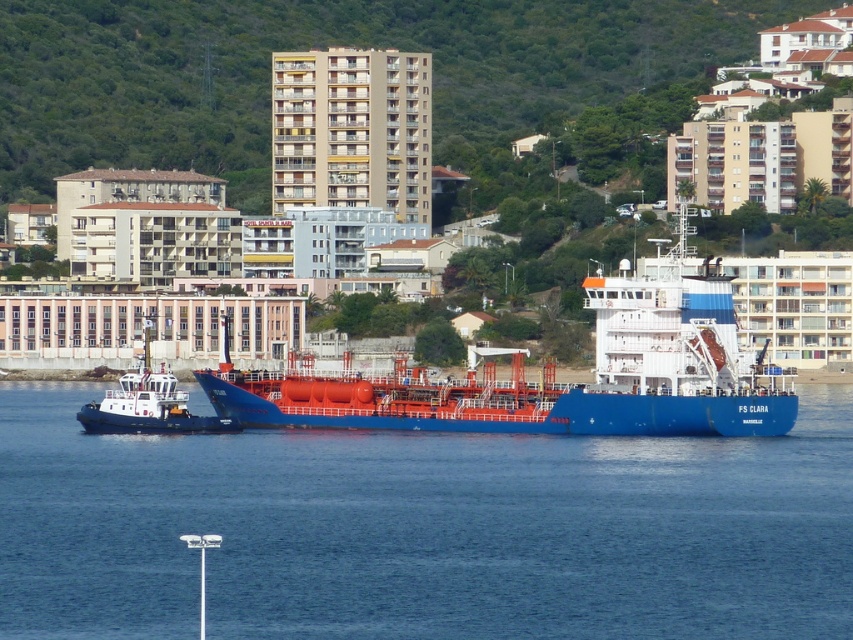
You are a harbor pilot planning to maneuver the blue matte ship at center into a nearby dock. The minimum safe distance required between the ship and any nearby structures is 1000 feet. Can the ship safely dock without violating the safety regulations?

The blue matte ship at center is 1030.60 feet away from the nearest structure. Since this distance exceeds the minimum safe requirement of 1000 feet, the ship can safely dock without violating safety regulations.

Consider the image. You are standing on the dock and see the blue matte ship at center and the blue water at center. Which object is positioned lower in the scene?

The blue water at center is located below the blue matte ship at center, so it is positioned lower in the scene.

You are standing on the deck of the FS CLARA cargo ship and want to know the distance to the point at coordinates (593, 276). Can you determine if this point is within a 1000 feet safety zone from your current position?

The point at coordinates (593, 276) is 1104.64 feet away from the viewer, which exceeds the 1000 feet safety zone. Therefore, it is outside the safety zone.